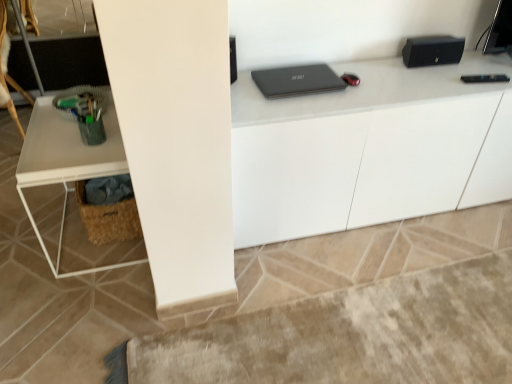
Locate an element on the screen. The image size is (512, 384). vacant area that is in front of matte black laptop at center is located at coordinates (286, 114).